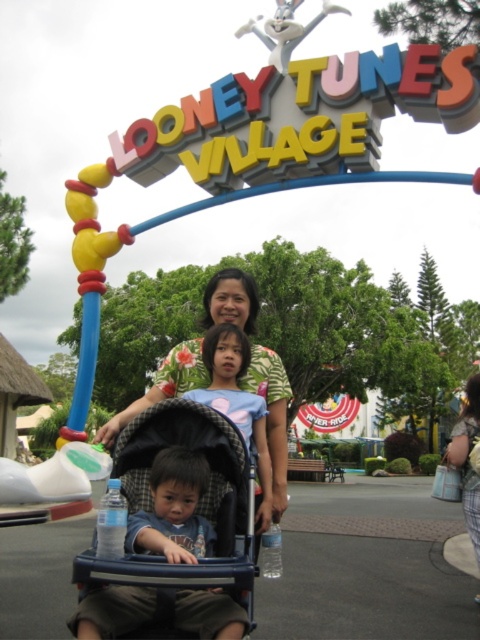
In the scene shown: Between blue plastic baby carriage at center and floral print shirt at center, which one has less height?

Standing shorter between the two is blue plastic baby carriage at center.

Does blue plastic baby carriage at center appear over floral print shirt at center?

Incorrect, blue plastic baby carriage at center is not positioned above floral print shirt at center.

Is point (180, 428) positioned before point (275, 440)?

Yes, point (180, 428) is in front of point (275, 440).

Locate an element on the screen. The height and width of the screenshot is (640, 480). blue plastic baby carriage at center is located at coordinates [199, 500].

Can you confirm if floral print shirt at center is shorter than floral shirt at center?

In fact, floral print shirt at center may be taller than floral shirt at center.

The width and height of the screenshot is (480, 640). I want to click on floral print shirt at center, so click(x=272, y=416).

Describe the element at coordinates (272, 416) in the screenshot. This screenshot has height=640, width=480. I see `floral print shirt at center` at that location.

Locate an element on the screen. floral print shirt at center is located at coordinates (272, 416).

Based on the photo, can you confirm if blue denim shirt at center is positioned to the right of floral shirt at center?

Incorrect, blue denim shirt at center is not on the right side of floral shirt at center.

Who is taller, blue denim shirt at center or floral shirt at center?

Standing taller between the two is floral shirt at center.

Locate an element on the screen. This screenshot has height=640, width=480. blue denim shirt at center is located at coordinates (237, 401).

Locate an element on the screen. blue denim shirt at center is located at coordinates (237, 401).